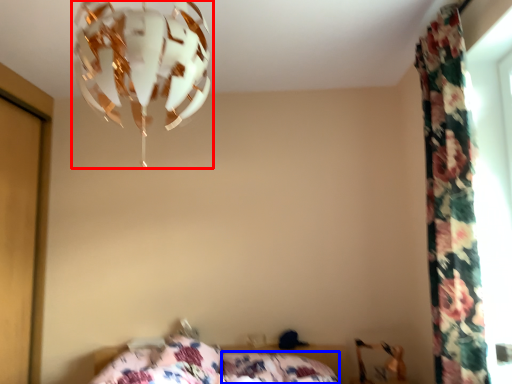
Question: Which object is closer to the camera taking this photo, lamp (highlighted by a red box) or pillow (highlighted by a blue box)?

Choices:
 (A) lamp
 (B) pillow

Answer: (A)